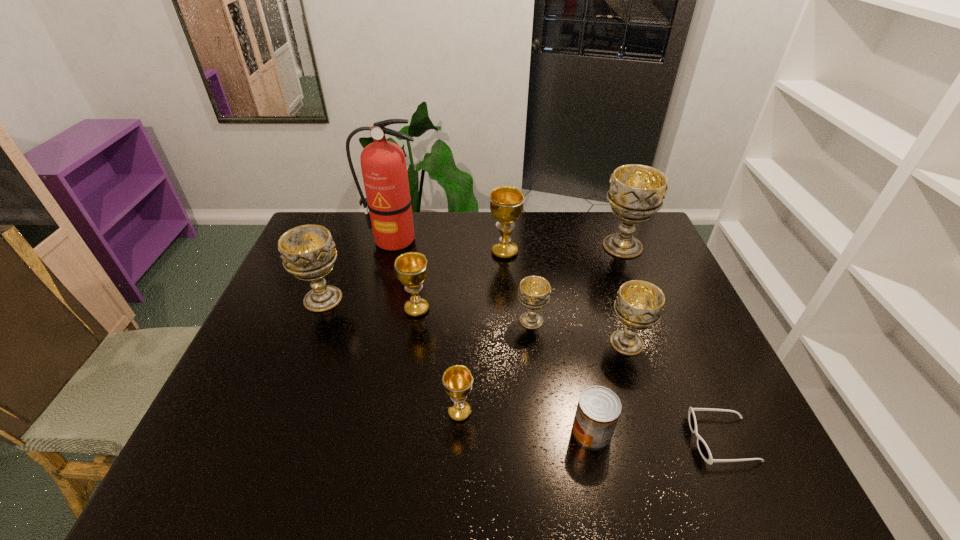
Locate an element on the screen. This screenshot has height=540, width=960. vacant space that satisfies the following two spatial constraints: 1. on the side of the tallest object with the nozzle and handle; 2. on the right side of the tallest chalice is located at coordinates (393, 246).

At what (x,y) coordinates should I click in order to perform the action: click on vacant position in the image that satisfies the following two spatial constraints: 1. on the back side of the seventh object from left to right; 2. on the left side of the biggest white chalice. Please return your answer as a coordinate pair (x, y). Image resolution: width=960 pixels, height=540 pixels. Looking at the image, I should click on (553, 246).

This screenshot has width=960, height=540. What are the coordinates of `free space in the image that satisfies the following two spatial constraints: 1. on the side of the biggest white chalice with the nozzle and handle; 2. on the left side of the red fire extinguisher` in the screenshot? It's located at (393, 246).

This screenshot has width=960, height=540. What are the coordinates of `vacant region that satisfies the following two spatial constraints: 1. on the back side of the farthest white chalice; 2. on the right side of the second gold chalice from left to right` in the screenshot? It's located at (467, 246).